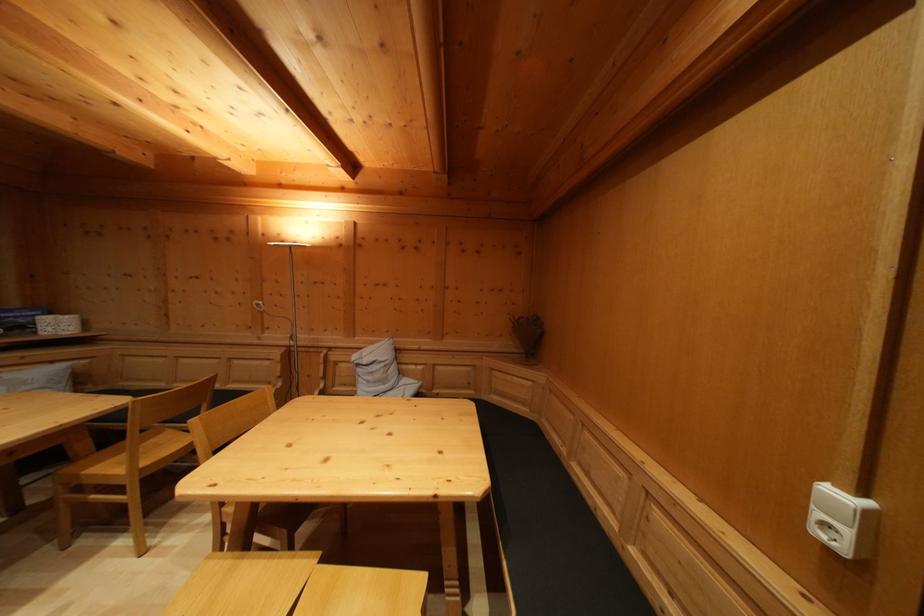
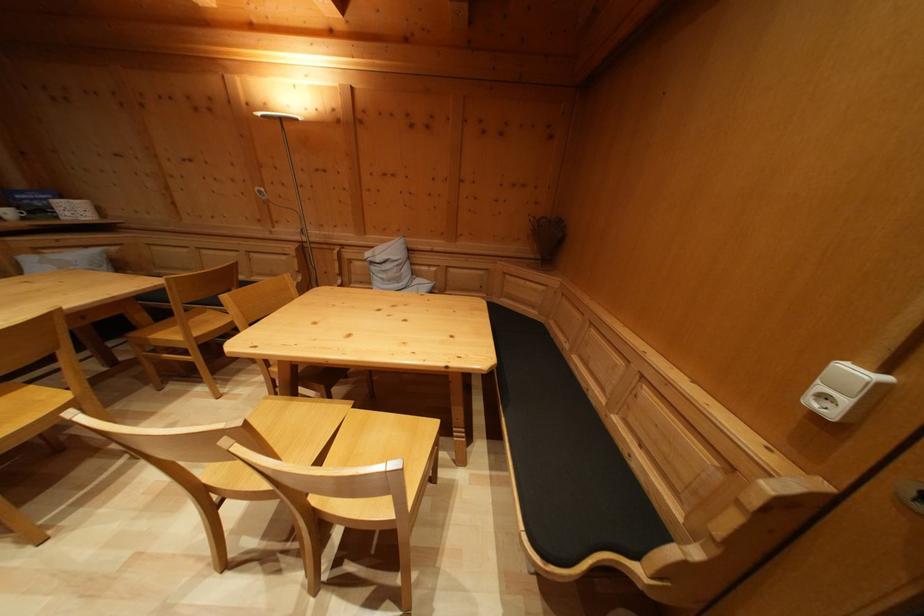
Find the pixel in the second image that matches pixel 253 552 in the first image.

(300, 400)